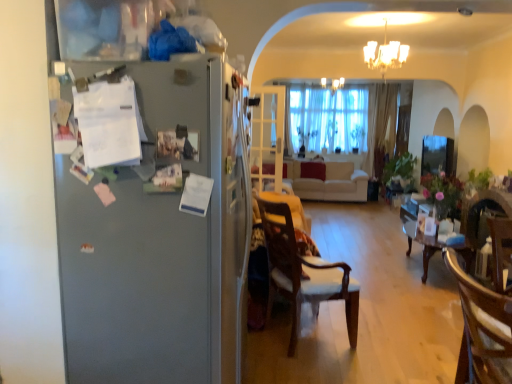
Question: From a real-world perspective, is satin silver refrigerator at left located beneath beige fabric couch at center?

Choices:
 (A) yes
 (B) no

Answer: (B)

Question: Is satin silver refrigerator at left far away from beige fabric couch at center?

Choices:
 (A) yes
 (B) no

Answer: (A)

Question: Does satin silver refrigerator at left come in front of beige fabric couch at center?

Choices:
 (A) no
 (B) yes

Answer: (B)

Question: Is satin silver refrigerator at left taller than beige fabric couch at center?

Choices:
 (A) no
 (B) yes

Answer: (B)

Question: Does satin silver refrigerator at left appear on the left side of beige fabric couch at center?

Choices:
 (A) no
 (B) yes

Answer: (B)

Question: Is satin silver refrigerator at left positioned beyond the bounds of beige fabric couch at center?

Choices:
 (A) no
 (B) yes

Answer: (B)

Question: From a real-world perspective, is transparent glass window screen at center physically below wooden chair at lower right, the 2th chair viewed from the left?

Choices:
 (A) yes
 (B) no

Answer: (B)

Question: Does transparent glass window screen at center appear on the right side of wooden chair at lower right, the 2th chair viewed from the left?

Choices:
 (A) no
 (B) yes

Answer: (B)

Question: Is wooden chair at lower right, the 2th chair viewed from the left, completely or partially inside transparent glass window screen at center?

Choices:
 (A) no
 (B) yes

Answer: (A)

Question: Is transparent glass window screen at center facing towards wooden chair at lower right, the first chair when ordered from right to left?

Choices:
 (A) yes
 (B) no

Answer: (B)

Question: Is transparent glass window screen at center in front of wooden chair at lower right, which appears as the 1th chair when viewed from the front?

Choices:
 (A) no
 (B) yes

Answer: (A)

Question: Is transparent glass window screen at center turned away from wooden chair at lower right, which appears as the 1th chair when viewed from the front?

Choices:
 (A) no
 (B) yes

Answer: (A)

Question: Considering the relative positions of white glass chandelier at upper center, acting as the first light fixture starting from the front, and white glass door at center in the image provided, is white glass chandelier at upper center, acting as the first light fixture starting from the front, to the right of white glass door at center from the viewer's perspective?

Choices:
 (A) yes
 (B) no

Answer: (A)